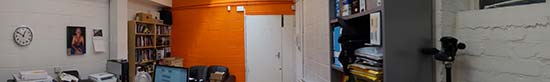
The height and width of the screenshot is (82, 550). I want to click on box, so tap(28, 76).